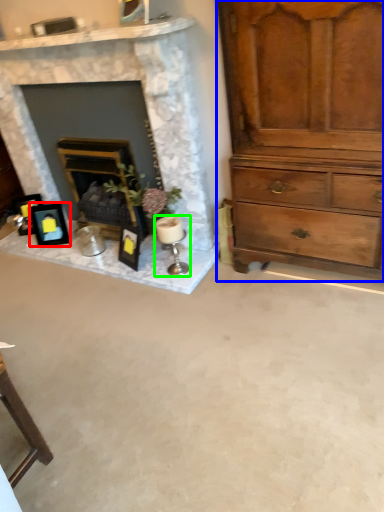
Question: Which object is positioned closest to picture frame (highlighted by a red box)? Select from chest of drawers (highlighted by a blue box) and candle holder (highlighted by a green box).

Choices:
 (A) chest of drawers
 (B) candle holder

Answer: (B)